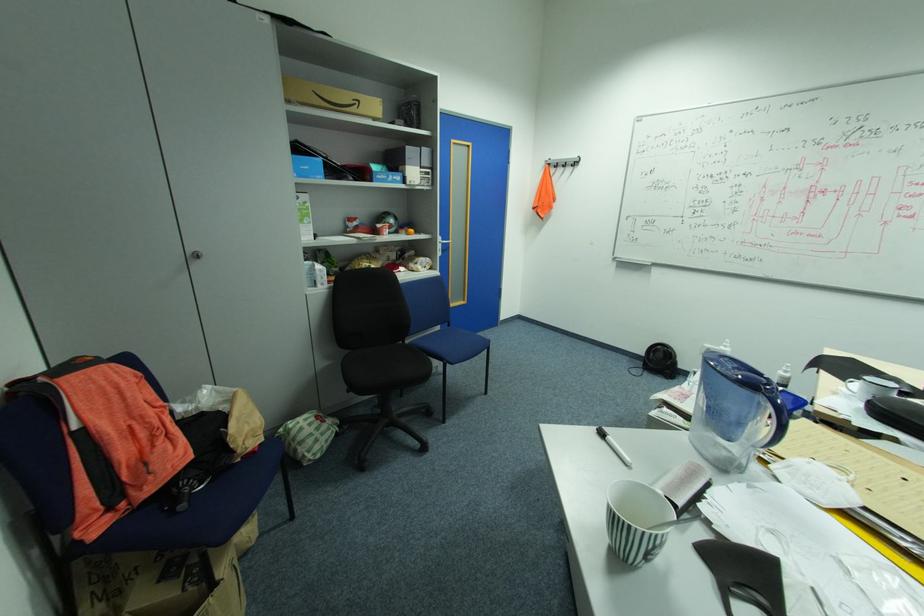
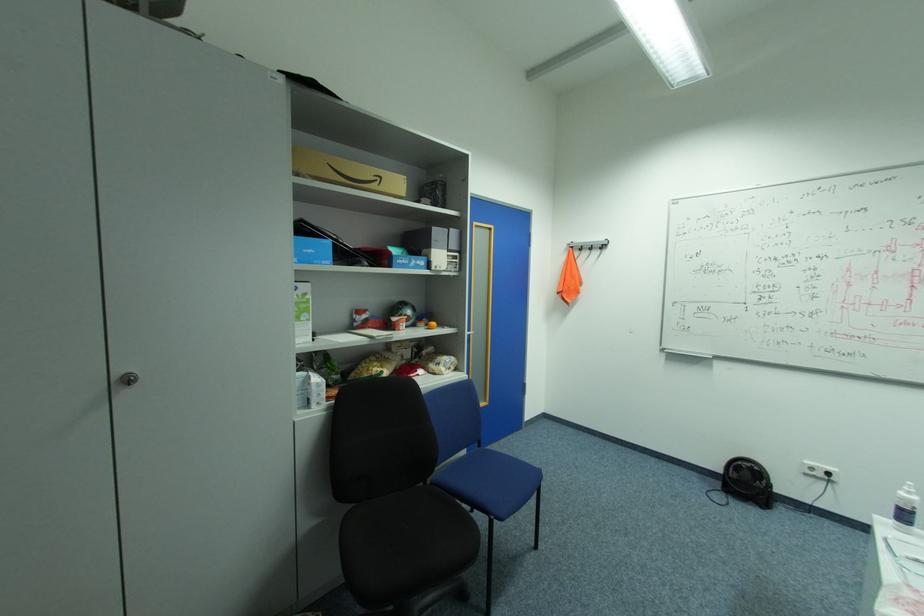
In the second image, find the point that corresponds to (579,163) in the first image.

(608, 246)